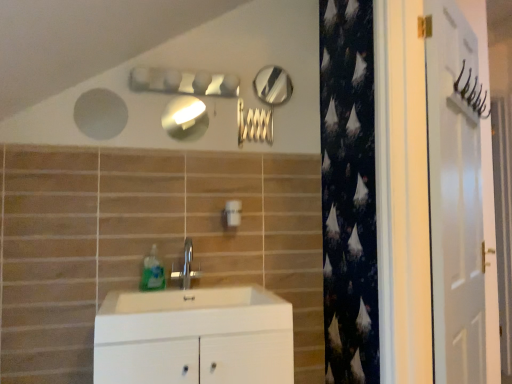
Question: In terms of size, does polished silver mirror at upper center, acting as the first mirror starting from the top, appear bigger or smaller than matte silver mirror at upper center, the 2th mirror from the back?

Choices:
 (A) small
 (B) big

Answer: (B)

Question: Is point (276, 87) positioned closer to the camera than point (173, 107)?

Choices:
 (A) farther
 (B) closer

Answer: (B)

Question: Based on their relative distances, which object is nearer to the white plastic light switch at center?

Choices:
 (A) white matte cabinet at center
 (B) polished silver mirror at upper center, the first mirror in the back-to-front sequence
 (C) white glossy door at right
 (D) translucent plastic soap dispenser at sink
 (E) matte silver mirror at upper center, the second mirror when ordered from top to bottom

Answer: (D)

Question: Estimate the real-world distances between objects in this image. Which object is farther from the white plastic light switch at center?

Choices:
 (A) matte silver mirror at upper center, the second mirror when ordered from top to bottom
 (B) translucent plastic soap dispenser at sink
 (C) silver metallic faucet at center
 (D) white glossy door at right
 (E) polished silver mirror at upper center, acting as the first mirror starting from the top

Answer: (D)